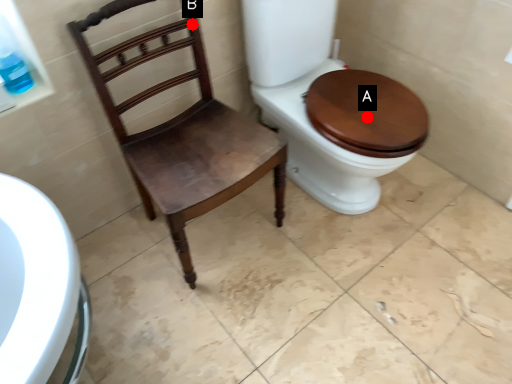
Question: Two points are circled on the image, labeled by A and B beside each circle. Which point appears farthest from the camera in this image?

Choices:
 (A) A is further
 (B) B is further

Answer: (B)